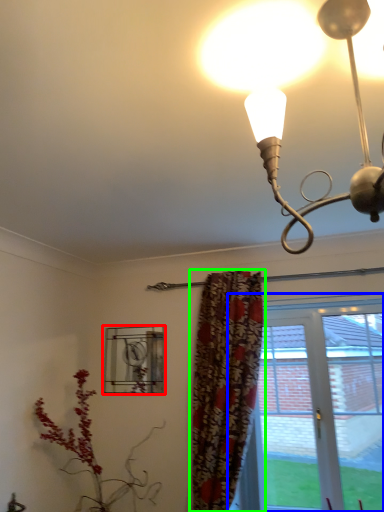
Question: Which object is the farthest from window (highlighted by a red box)? Choose among these: window (highlighted by a blue box) or curtain (highlighted by a green box).

Choices:
 (A) window
 (B) curtain

Answer: (A)